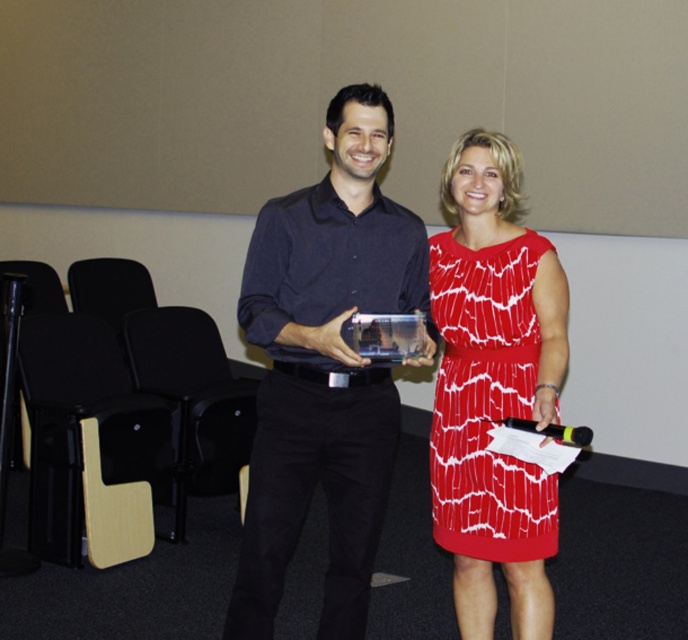
You are a photographer at the event and need to adjust the lighting to focus on the matte black shirt at center. Based on its coordinates, where should you position the light source relative to the shirt?

The matte black shirt at center is located at coordinates point [323,369]. To effectively illuminate it, position the light source directly in front of the shirt at those coordinates to ensure even lighting.

You are a photographer at a ceremony. You need to capture a photo of the matte black shirt at center and the red printed dress at center. The camera has a minimum focus distance of 12 inches. Will both subjects be in focus if they are positioned exactly as shown?

The matte black shirt at center is 11.49 inches from the red printed dress at center. Since the distance between them is less than the camera minimum focus distance of 12 inches, the camera may not be able to focus on both subjects simultaneously, resulting in one being blurry.

You are a photographer positioned at the back of the room. You want to take a photo of both the matte black shirt at center and the red printed dress at center. Which one should you focus on first to ensure both are in focus?

You should focus on the matte black shirt at center first because it is closer to the viewer than the red printed dress at center, so adjusting focus from near to far will help both be in focus.